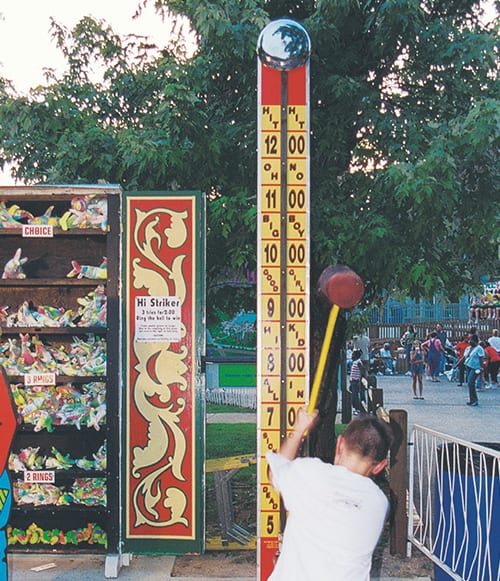
The image size is (500, 581). Find the location of `toys`. toys is located at coordinates (84, 528), (94, 260).